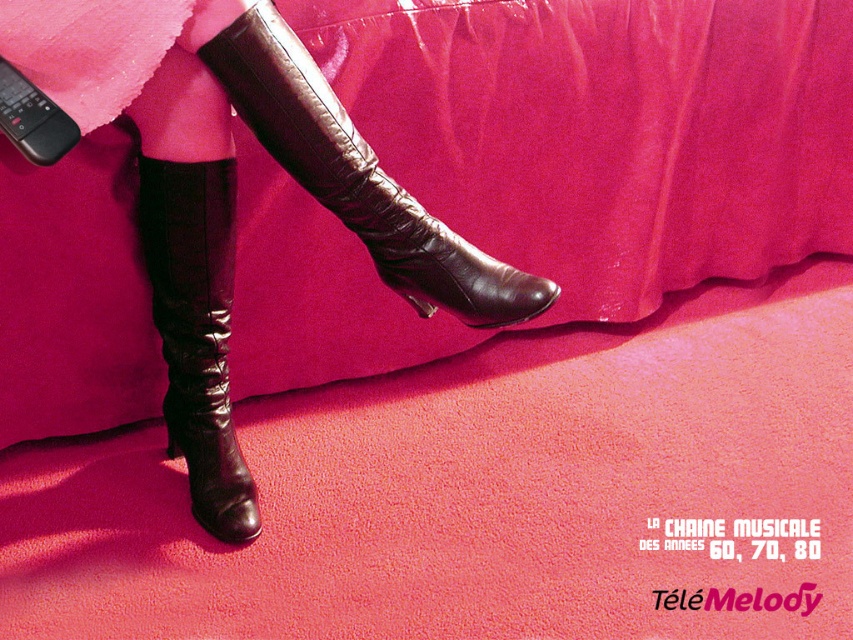
You are a fashion designer who needs to create a matching accessory for the outfit shown. The accessory must be placed between the velvet pink skirt at upper center and the shiny black boot at lower left. Given the distance between them, what is the maximum length the accessory can be to ensure it fits without overlapping either item?

The maximum length the accessory can be is 14.23 inches, as this is the distance between the velvet pink skirt at upper center and the shiny black boot at lower left. The accessory must be shorter than or equal to this measurement to fit without overlapping either item.

You are a fashion designer trying to create a cohesive outfit. You have a velvet pink skirt at upper center and a shiny brown leather boot at center. Given their positions, can you place them together in a way that maintains visual harmony?

The velvet pink skirt at upper center is 14.00 inches from the shiny brown leather boot at center, so placing them close together at this distance would maintain visual harmony as they are already positioned near each other in the image.

You are a photographer adjusting the focus on your camera. You want to ensure that the text in the lower right corner of the image is in focus. Given that the text is located at point (x=463, y=296), and the distance from the camera to this point is 1.19 meters, what is the minimum distance you should set your camera focus to capture the text clearly?

The text located at point (x=463, y=296) is 1.19 meters away from the camera. To ensure it is in focus, the camera should be set to a focus distance of at least 1.19 meters.